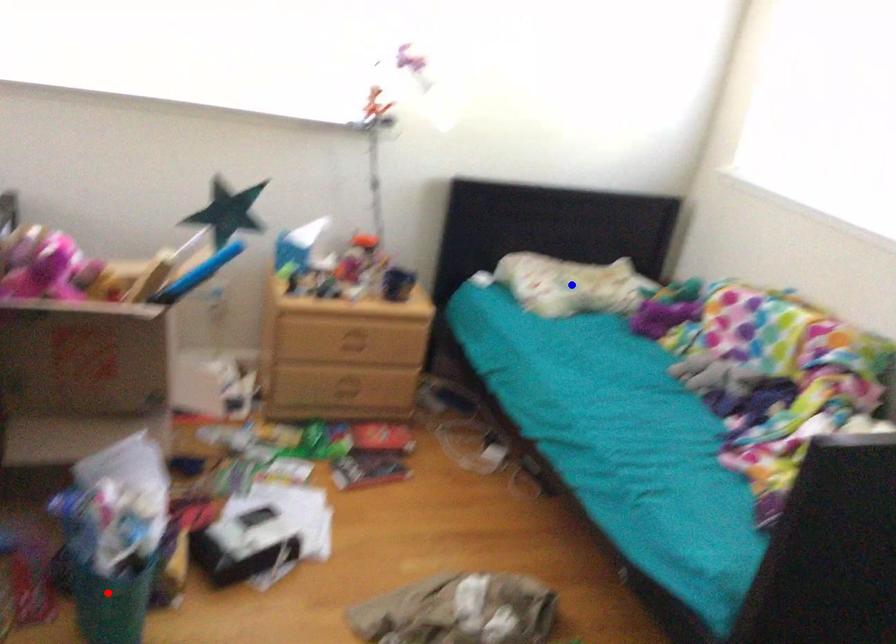
Question: In the image, two points are highlighted. Which point is nearer to the camera? Reply with the corresponding letter.

Choices:
 (A) blue point
 (B) red point

Answer: (B)